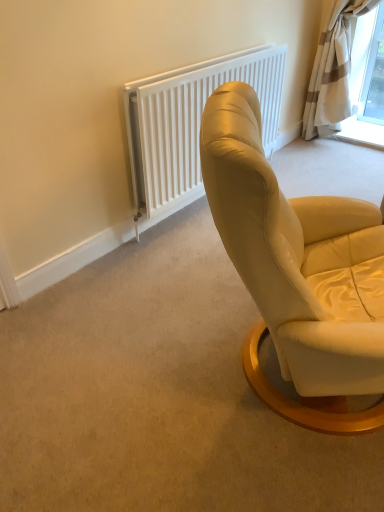
The height and width of the screenshot is (512, 384). Identify the location of beige striped fabric curtain at upper right. (332, 71).

Describe the element at coordinates (332, 71) in the screenshot. The height and width of the screenshot is (512, 384). I see `beige striped fabric curtain at upper right` at that location.

Locate an element on the screen. The width and height of the screenshot is (384, 512). white textured radiator at upper center is located at coordinates (190, 121).

This screenshot has width=384, height=512. Describe the element at coordinates (190, 121) in the screenshot. I see `white textured radiator at upper center` at that location.

You are a GUI agent. You are given a task and a screenshot of the screen. Output one action in this format:
    pyautogui.click(x=<x>, y=<y>)
    Task: Click on the beige striped fabric curtain at upper right
    Image resolution: width=384 pixels, height=512 pixels.
    Given the screenshot: What is the action you would take?
    pyautogui.click(x=332, y=71)

Considering the relative positions of white textured radiator at upper center and beige striped fabric curtain at upper right in the image provided, is white textured radiator at upper center to the left of beige striped fabric curtain at upper right from the viewer's perspective?

Correct, you'll find white textured radiator at upper center to the left of beige striped fabric curtain at upper right.

Considering the positions of objects white textured radiator at upper center and beige striped fabric curtain at upper right in the image provided, who is behind, white textured radiator at upper center or beige striped fabric curtain at upper right?

beige striped fabric curtain at upper right.

Does point (136, 168) lie behind point (337, 106)?

No, (136, 168) is in front of (337, 106).

From the image's perspective, between white textured radiator at upper center and beige striped fabric curtain at upper right, who is located below?

white textured radiator at upper center.

From a real-world perspective, is white textured radiator at upper center beneath beige striped fabric curtain at upper right?

Correct, in the physical world, white textured radiator at upper center is lower than beige striped fabric curtain at upper right.

Looking at their sizes, would you say white textured radiator at upper center is wider or thinner than beige striped fabric curtain at upper right?

Considering their sizes, white textured radiator at upper center looks slimmer than beige striped fabric curtain at upper right.

Which of these two, white textured radiator at upper center or beige striped fabric curtain at upper right, stands shorter?

Standing shorter between the two is white textured radiator at upper center.

In terms of size, does white textured radiator at upper center appear bigger or smaller than beige striped fabric curtain at upper right?

white textured radiator at upper center is smaller than beige striped fabric curtain at upper right.

Is beige striped fabric curtain at upper right located within white textured radiator at upper center?

No, beige striped fabric curtain at upper right is not inside white textured radiator at upper center.

Does white textured radiator at upper center touch beige striped fabric curtain at upper right?

white textured radiator at upper center is not next to beige striped fabric curtain at upper right, and they're not touching.

In the scene shown: Is white textured radiator at upper center facing towards beige striped fabric curtain at upper right?

No, white textured radiator at upper center is not turned towards beige striped fabric curtain at upper right.

How different are the orientations of white textured radiator at upper center and beige striped fabric curtain at upper right in degrees?

There is a 88.9-degree angle between the facing directions of white textured radiator at upper center and beige striped fabric curtain at upper right.

Where is `curtain on the right side of white textured radiator at upper center`? This screenshot has width=384, height=512. curtain on the right side of white textured radiator at upper center is located at coordinates (332, 71).

Would you say beige striped fabric curtain at upper right is to the left or to the right of white textured radiator at upper center in the picture?

Clearly, beige striped fabric curtain at upper right is on the right of white textured radiator at upper center in the image.

Relative to white textured radiator at upper center, is beige striped fabric curtain at upper right in front or behind?

In the image, beige striped fabric curtain at upper right appears behind white textured radiator at upper center.

Is point (348, 96) closer or farther from the camera than point (196, 67)?

Point (348, 96) appears to be farther away from the viewer than point (196, 67).

From the image's perspective, is beige striped fabric curtain at upper right over white textured radiator at upper center?

Yes.

From a real-world perspective, which is physically above, beige striped fabric curtain at upper right or white textured radiator at upper center?

beige striped fabric curtain at upper right.

Which of these two, beige striped fabric curtain at upper right or white textured radiator at upper center, is thinner?

With smaller width is white textured radiator at upper center.

Is beige striped fabric curtain at upper right taller or shorter than white textured radiator at upper center?

Considering their sizes, beige striped fabric curtain at upper right has more height than white textured radiator at upper center.

In terms of size, does beige striped fabric curtain at upper right appear bigger or smaller than white textured radiator at upper center?

In the image, beige striped fabric curtain at upper right appears to be larger than white textured radiator at upper center.

Is beige striped fabric curtain at upper right inside or outside of white textured radiator at upper center?

beige striped fabric curtain at upper right exists outside the volume of white textured radiator at upper center.

Is beige striped fabric curtain at upper right directly adjacent to white textured radiator at upper center?

There is a gap between beige striped fabric curtain at upper right and white textured radiator at upper center.

Is beige striped fabric curtain at upper right oriented towards white textured radiator at upper center?

Yes, beige striped fabric curtain at upper right is facing white textured radiator at upper center.

In order to click on radiator in front of the beige striped fabric curtain at upper right in this screenshot , I will do `click(190, 121)`.

Locate an element on the screen. curtain behind the white textured radiator at upper center is located at coordinates (332, 71).

Find the location of `radiator that appears below the beige striped fabric curtain at upper right (from a real-world perspective)`. radiator that appears below the beige striped fabric curtain at upper right (from a real-world perspective) is located at coordinates (190, 121).